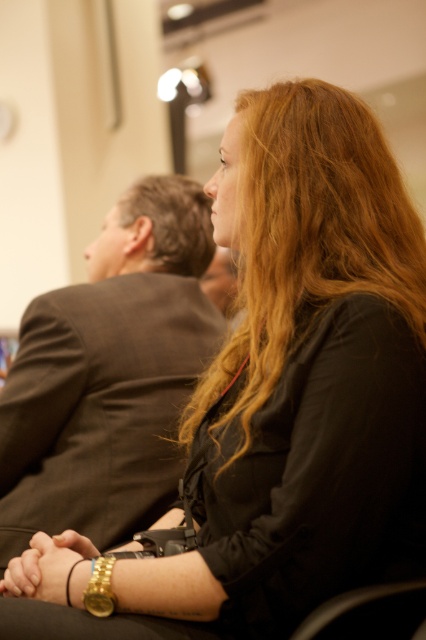
Question: Which of the following is the closest to the observer?

Choices:
 (A) gold metallic bracelet at center
 (B) blonde hair at center

Answer: (A)

Question: Does dark brown suit at center have a larger size compared to brownhair at left?

Choices:
 (A) no
 (B) yes

Answer: (B)

Question: Can you confirm if brownhair at left is positioned to the right of gold metallic bracelet at center?

Choices:
 (A) yes
 (B) no

Answer: (A)

Question: Which of the following is the farthest from the observer?

Choices:
 (A) dark brown suit at center
 (B) brownhair at left

Answer: (B)

Question: Estimate the real-world distances between objects in this image. Which object is farther from the brownhair at left?

Choices:
 (A) dark brown suit at center
 (B) gold metallic bracelet at center
 (C) blonde hair at center

Answer: (B)

Question: Can you confirm if dark brown suit at center is positioned below gold metallic bracelet at lower center?

Choices:
 (A) yes
 (B) no

Answer: (B)